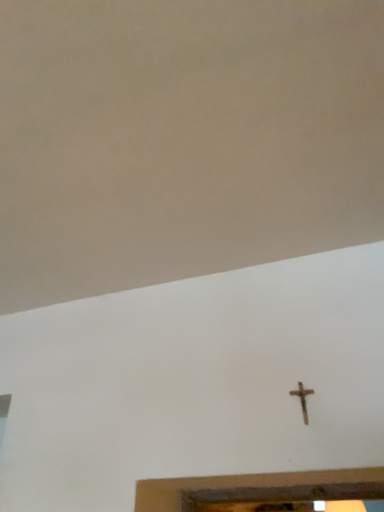
Question: From the image's perspective, is rusty metal cross at center-right above or below beige matte wall at upper center?

Choices:
 (A) below
 (B) above

Answer: (A)

Question: Is rusty metal cross at center-right inside the boundaries of beige matte wall at upper center, or outside?

Choices:
 (A) inside
 (B) outside

Answer: (B)

Question: Does point (302, 416) appear closer or farther from the camera than point (153, 263)?

Choices:
 (A) farther
 (B) closer

Answer: (B)

Question: Do you think beige matte wall at upper center is within rusty metal cross at center-right, or outside of it?

Choices:
 (A) outside
 (B) inside

Answer: (A)

Question: From the image's perspective, is beige matte wall at upper center located above or below rusty metal cross at center-right?

Choices:
 (A) above
 (B) below

Answer: (A)

Question: Considering the positions of beige matte wall at upper center and rusty metal cross at center-right in the image, is beige matte wall at upper center wider or thinner than rusty metal cross at center-right?

Choices:
 (A) wide
 (B) thin

Answer: (A)

Question: From their relative heights in the image, would you say beige matte wall at upper center is taller or shorter than rusty metal cross at center-right?

Choices:
 (A) short
 (B) tall

Answer: (A)